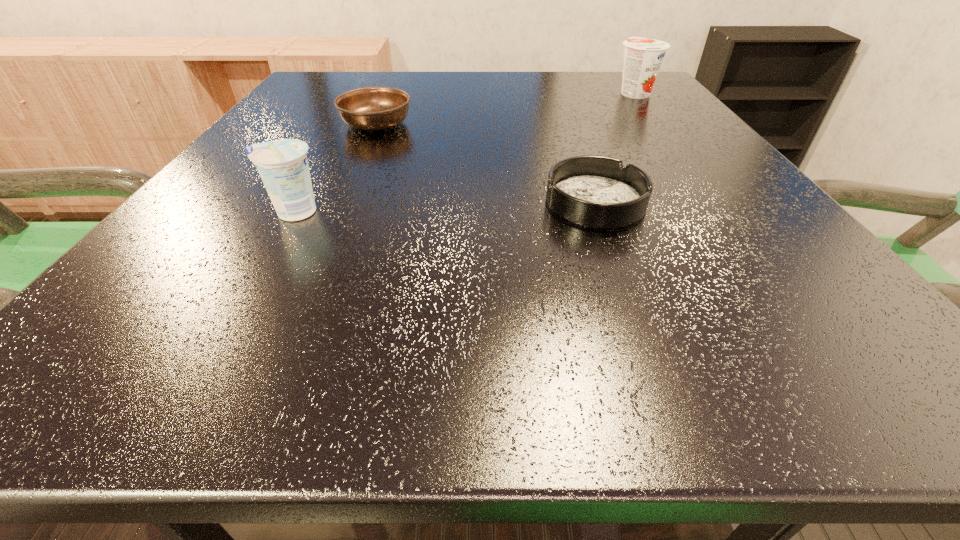
The height and width of the screenshot is (540, 960). I want to click on free region located on the left of the second object from right to left, so click(503, 202).

Identify the location of object at the far edge. The image size is (960, 540). (643, 57).

You are a GUI agent. You are given a task and a screenshot of the screen. Output one action in this format:
    pyautogui.click(x=<x>, y=<y>)
    Task: Click on the yogurt positioned at the left edge
    The width and height of the screenshot is (960, 540).
    Given the screenshot: What is the action you would take?
    pyautogui.click(x=282, y=164)

The width and height of the screenshot is (960, 540). Identify the location of soup bowl at the left edge. (372, 108).

Locate an element on the screen. object at the right edge is located at coordinates [643, 57].

Find the location of a particular element. The height and width of the screenshot is (540, 960). object located in the far right corner section of the desktop is located at coordinates (643, 57).

You are a GUI agent. You are given a task and a screenshot of the screen. Output one action in this format:
    pyautogui.click(x=<x>, y=<y>)
    Task: Click on the vacant space at the far edge of the desktop
    
    Given the screenshot: What is the action you would take?
    pyautogui.click(x=552, y=100)

This screenshot has width=960, height=540. I want to click on free location at the near edge, so click(x=351, y=326).

In order to click on vacant space at the left edge of the desktop in this screenshot , I will do `click(219, 278)`.

This screenshot has width=960, height=540. I want to click on free space at the right edge, so click(645, 116).